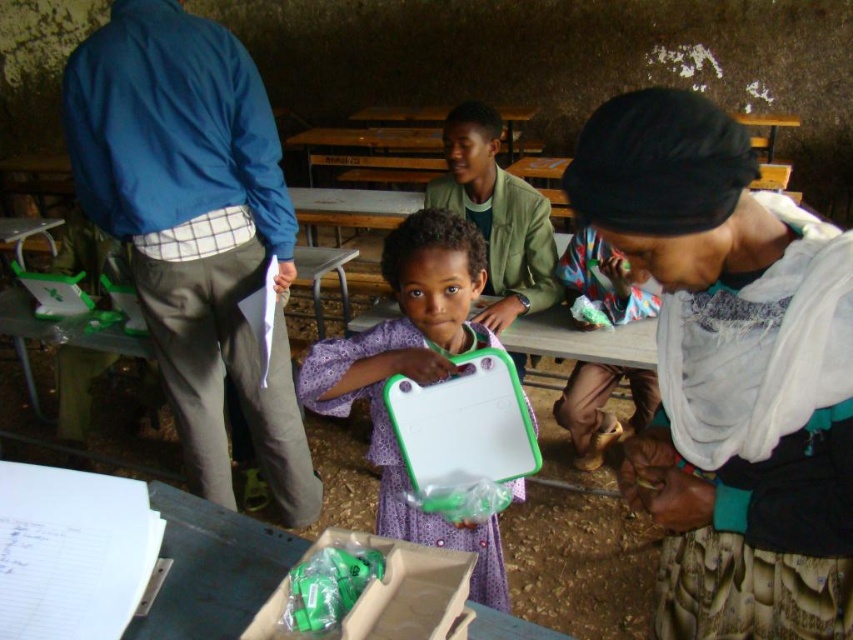
You are a student in the classroom and need to place your green plastic tray at center on a desk. However, there is a white cloth headscarf at upper right nearby. Which object is positioned higher, making it possible to place the tray without obstruction?

The white cloth headscarf at upper right is above the green plastic tray at center, so placing the tray on the desk won

You are organizing a classroom inventory and need to compare the widths of two items. Which item is narrower between the white cloth headscarf at upper right and the green plastic tray at center?

The white cloth headscarf at upper right is narrower than the green plastic tray at center.